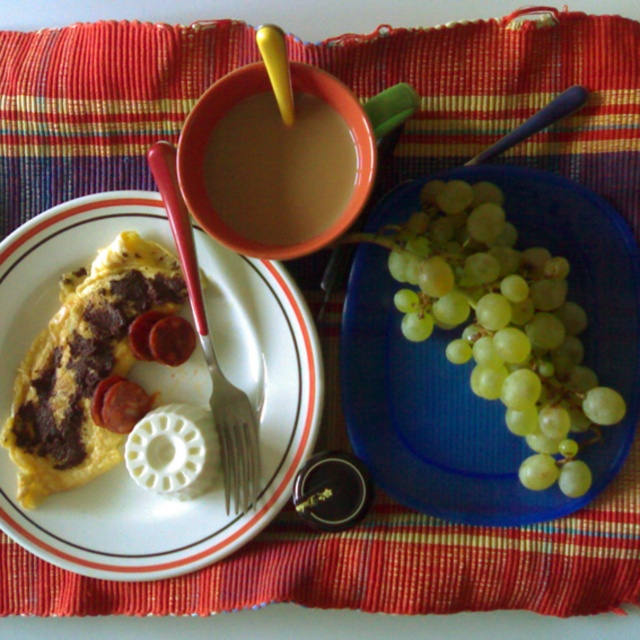
Question: Which object is positioned farthest from the white glossy plate at upper left?

Choices:
 (A) smooth yellow omelette with sausage at left
 (B) green matte grapes at right
 (C) silver metallic fork at lower left

Answer: (B)

Question: Is white glossy plate at upper left further to the viewer compared to green matte grapes at right?

Choices:
 (A) no
 (B) yes

Answer: (B)

Question: Which object is the farthest from the white glossy plate at upper left?

Choices:
 (A) silver metallic fork at lower left
 (B) smooth yellow omelette with sausage at left

Answer: (A)

Question: Is white glossy plate at upper left further to camera compared to brown matte cup at upper center?

Choices:
 (A) no
 (B) yes

Answer: (B)

Question: Among these objects, which one is nearest to the camera?

Choices:
 (A) green matte grapes at right
 (B) silver metallic fork at lower left

Answer: (A)

Question: Is white glossy plate at upper left to the right of brown matte cup at upper center from the viewer's perspective?

Choices:
 (A) yes
 (B) no

Answer: (B)